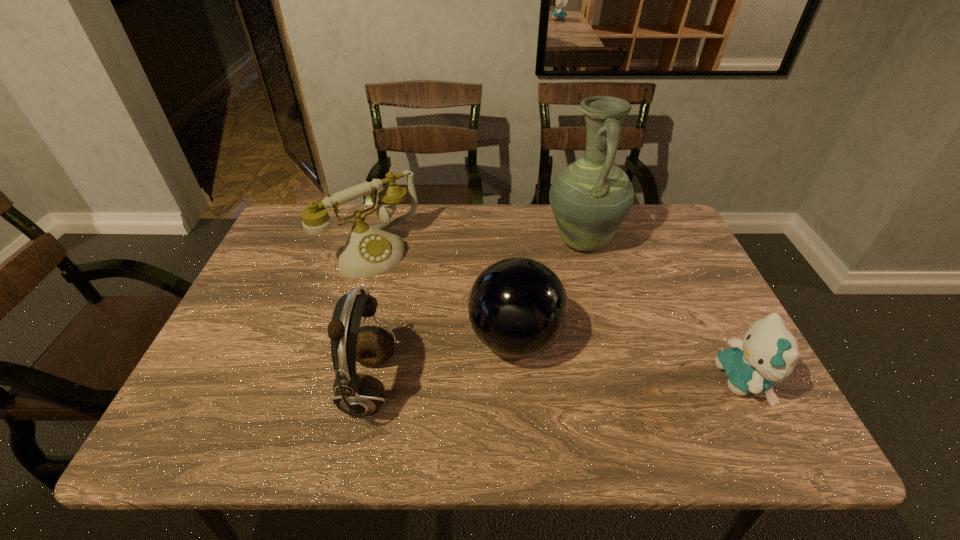
The height and width of the screenshot is (540, 960). Find the location of `blank space located on the dial of the telephone`. blank space located on the dial of the telephone is located at coordinates (444, 318).

Image resolution: width=960 pixels, height=540 pixels. In order to click on blank space located 0.300m on the dial of the telephone in this screenshot , I will do `click(463, 337)`.

At what (x,y) coordinates should I click in order to perform the action: click on vacant space located on the dial of the telephone. Please return your answer as a coordinate pair (x, y). Image resolution: width=960 pixels, height=540 pixels. Looking at the image, I should click on (408, 284).

Locate an element on the screen. The height and width of the screenshot is (540, 960). vacant space located on the side of the bowling ball with the finger holes is located at coordinates (583, 370).

Locate an element on the screen. The width and height of the screenshot is (960, 540). vacant area located on the side of the bowling ball with the finger holes is located at coordinates (660, 405).

Where is `free space located on the side of the bowling ball with the finger holes`? This screenshot has width=960, height=540. free space located on the side of the bowling ball with the finger holes is located at coordinates (600, 378).

You are a GUI agent. You are given a task and a screenshot of the screen. Output one action in this format:
    pyautogui.click(x=<x>, y=<y>)
    Task: Click on the free spot located on the handle side of the tallest object
    
    Given the screenshot: What is the action you would take?
    tap(551, 327)

Find the location of `vacant area situated on the handle side of the tallest object`. vacant area situated on the handle side of the tallest object is located at coordinates (540, 357).

Where is `vacant area situated on the handle side of the tallest object`? The image size is (960, 540). vacant area situated on the handle side of the tallest object is located at coordinates (562, 296).

This screenshot has width=960, height=540. Find the location of `telephone located in the far edge section of the desktop`. telephone located in the far edge section of the desktop is located at coordinates (369, 251).